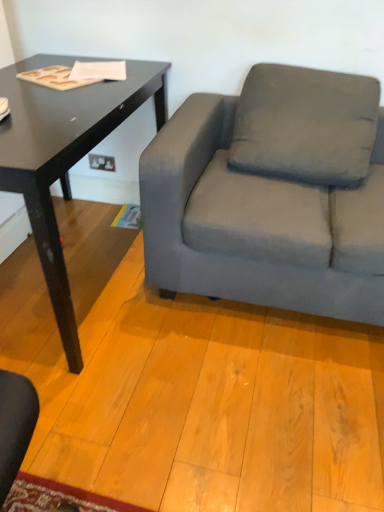
Question: Is black glossy table at left further to the viewer compared to gray fabric couch at right?

Choices:
 (A) no
 (B) yes

Answer: (A)

Question: Is black glossy table at left positioned before gray fabric couch at right?

Choices:
 (A) yes
 (B) no

Answer: (A)

Question: Could you tell me if black glossy table at left is facing gray fabric couch at right?

Choices:
 (A) yes
 (B) no

Answer: (A)

Question: Is black glossy table at left in contact with gray fabric couch at right?

Choices:
 (A) yes
 (B) no

Answer: (B)

Question: Is gray fabric couch at right surrounded by black glossy table at left?

Choices:
 (A) no
 (B) yes

Answer: (A)

Question: From the image's perspective, is gray fabric couch at right positioned above or below black glossy table at left?

Choices:
 (A) below
 (B) above

Answer: (B)

Question: Is gray fabric couch at right wider or thinner than black glossy table at left?

Choices:
 (A) thin
 (B) wide

Answer: (B)

Question: Based on their sizes in the image, would you say gray fabric couch at right is bigger or smaller than black glossy table at left?

Choices:
 (A) big
 (B) small

Answer: (A)

Question: From a real-world perspective, is gray fabric couch at right physically located above or below black glossy table at left?

Choices:
 (A) above
 (B) below

Answer: (A)

Question: In terms of size, does gray fabric pillow at center appear bigger or smaller than black glossy table at left?

Choices:
 (A) small
 (B) big

Answer: (A)

Question: Considering the positions of gray fabric pillow at center and black glossy table at left in the image, is gray fabric pillow at center taller or shorter than black glossy table at left?

Choices:
 (A) tall
 (B) short

Answer: (B)

Question: Is point (278, 166) closer or farther from the camera than point (39, 155)?

Choices:
 (A) closer
 (B) farther

Answer: (A)

Question: In terms of width, does gray fabric pillow at center look wider or thinner when compared to black glossy table at left?

Choices:
 (A) thin
 (B) wide

Answer: (A)

Question: Considering the positions of point click(11, 179) and point click(329, 113), is point click(11, 179) closer or farther from the camera than point click(329, 113)?

Choices:
 (A) farther
 (B) closer

Answer: (B)

Question: Do you think black glossy table at left is within gray fabric pillow at center, or outside of it?

Choices:
 (A) outside
 (B) inside

Answer: (A)